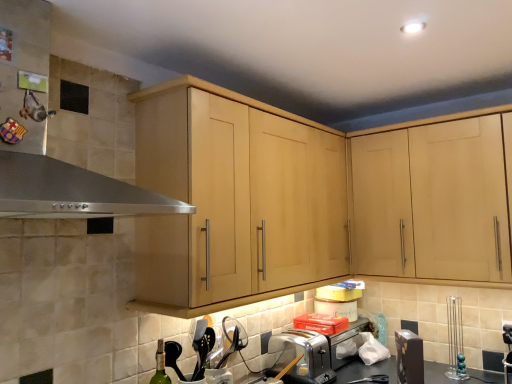
Question: Should I look upward or downward to see satin silver toaster at lower center?

Choices:
 (A) down
 (B) up

Answer: (A)

Question: Is green glass bottle at lower left thinner than stainless steel exhaust hood at upper left?

Choices:
 (A) yes
 (B) no

Answer: (A)

Question: Considering the relative sizes of green glass bottle at lower left and stainless steel exhaust hood at upper left in the image provided, is green glass bottle at lower left bigger than stainless steel exhaust hood at upper left?

Choices:
 (A) no
 (B) yes

Answer: (A)

Question: Can we say green glass bottle at lower left lies outside stainless steel exhaust hood at upper left?

Choices:
 (A) yes
 (B) no

Answer: (A)

Question: Is green glass bottle at lower left taller than stainless steel exhaust hood at upper left?

Choices:
 (A) yes
 (B) no

Answer: (B)

Question: Considering the relative sizes of green glass bottle at lower left and stainless steel exhaust hood at upper left in the image provided, is green glass bottle at lower left smaller than stainless steel exhaust hood at upper left?

Choices:
 (A) yes
 (B) no

Answer: (A)

Question: From a real-world perspective, is green glass bottle at lower left on stainless steel exhaust hood at upper left?

Choices:
 (A) no
 (B) yes

Answer: (A)

Question: Is green glass bottle at lower left positioned beyond the bounds of satin silver toaster at lower center?

Choices:
 (A) no
 (B) yes

Answer: (B)

Question: Is green glass bottle at lower left positioned with its back to satin silver toaster at lower center?

Choices:
 (A) yes
 (B) no

Answer: (B)

Question: Does green glass bottle at lower left have a larger size compared to satin silver toaster at lower center?

Choices:
 (A) no
 (B) yes

Answer: (A)

Question: Is green glass bottle at lower left taller than satin silver toaster at lower center?

Choices:
 (A) yes
 (B) no

Answer: (A)

Question: Is green glass bottle at lower left smaller than satin silver toaster at lower center?

Choices:
 (A) no
 (B) yes

Answer: (B)

Question: Is green glass bottle at lower left shorter than satin silver toaster at lower center?

Choices:
 (A) yes
 (B) no

Answer: (B)

Question: Is stainless steel exhaust hood at upper left thinner than green glass bottle at lower left?

Choices:
 (A) yes
 (B) no

Answer: (B)